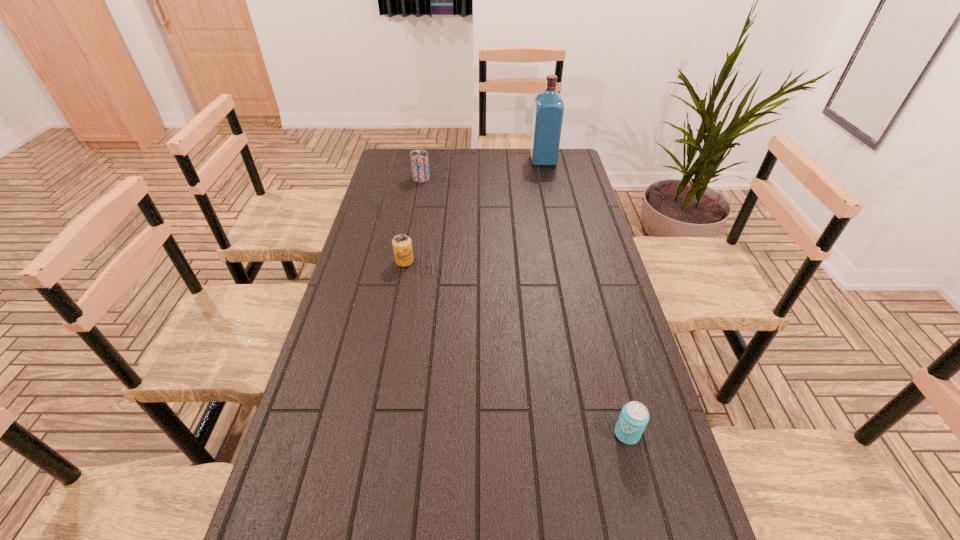
Identify the location of vacant area situated on the right of the second nearest beer can. (432, 261).

Identify the location of free space located on the left of the rightmost beer can. This screenshot has width=960, height=540. (491, 434).

The height and width of the screenshot is (540, 960). Find the location of `liquor that is at the far edge`. liquor that is at the far edge is located at coordinates (548, 112).

I want to click on beer can located in the far edge section of the desktop, so click(x=419, y=158).

This screenshot has width=960, height=540. I want to click on liquor present at the right edge, so click(548, 112).

This screenshot has width=960, height=540. I want to click on beer can that is positioned at the right edge, so [634, 416].

Find the location of a particular element. object that is at the far left corner is located at coordinates coord(419,158).

Identify the location of object present at the far right corner. (548, 112).

You are a GUI agent. You are given a task and a screenshot of the screen. Output one action in this format:
    pyautogui.click(x=<x>, y=<y>)
    Task: Click on the vacant space at the far edge
    This screenshot has height=540, width=960.
    Given the screenshot: What is the action you would take?
    pyautogui.click(x=508, y=157)

This screenshot has width=960, height=540. In the image, there is a desktop. Find the location of `vacant area at the left edge`. vacant area at the left edge is located at coordinates point(313,402).